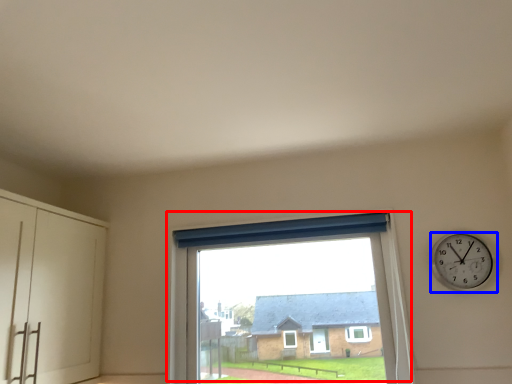
Question: Which of the following is the farthest to the observer, window (highlighted by a red box) or wall clock (highlighted by a blue box)?

Choices:
 (A) window
 (B) wall clock

Answer: (A)